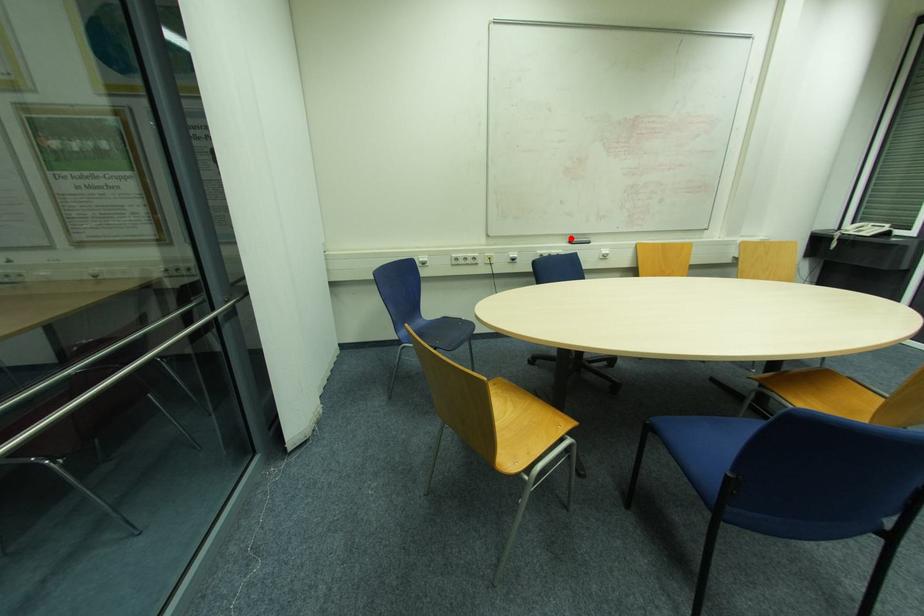
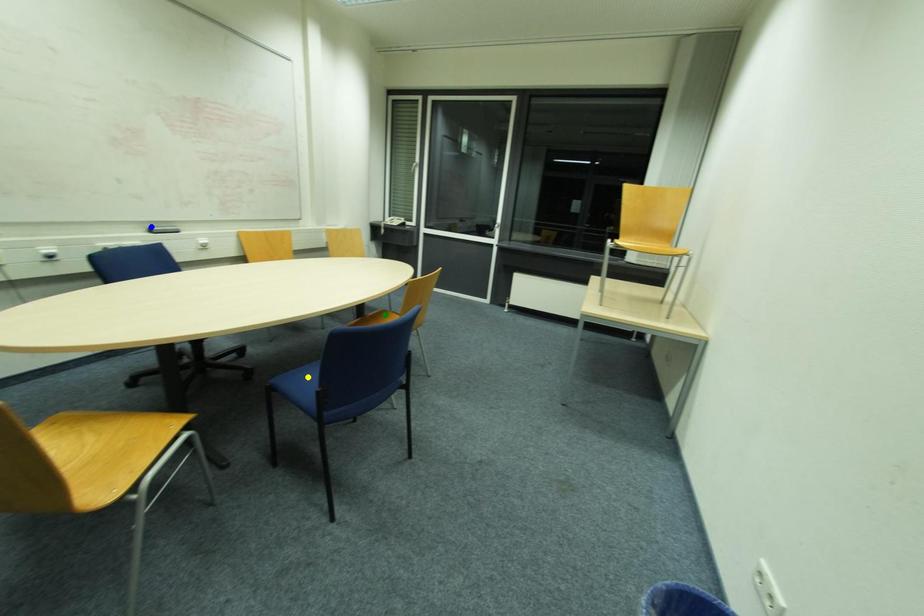
Question: I am providing you with two images of the same scene from different viewpoints. A red point is marked on the first image. You are given multiple points on the second image. Which point in image 2 represents the same 3d spot as the red point in image 1?

Choices:
 (A) green point
 (B) blue point
 (C) yellow point

Answer: (B)